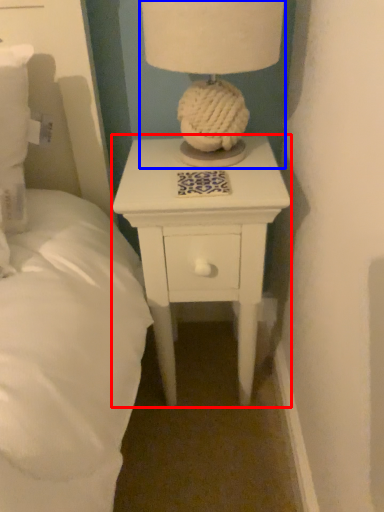
Question: Which point is closer to the camera, nightstand (highlighted by a red box) or table lamp (highlighted by a blue box)?

Choices:
 (A) nightstand
 (B) table lamp

Answer: (B)